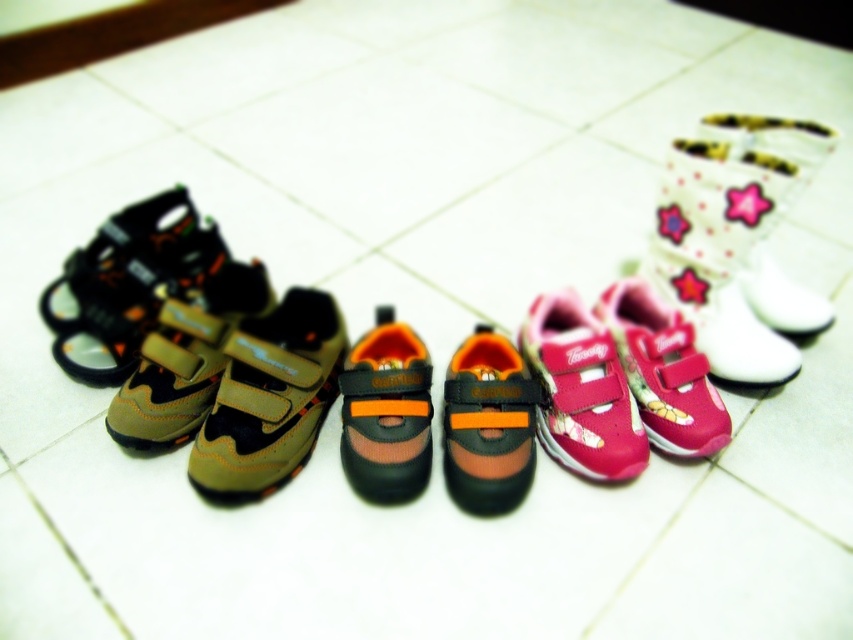
Question: Based on their relative distances, which object is farther from the pink velcro shoe at center?

Choices:
 (A) matte brown fabric shoe at left
 (B) pink velcro shoes at center
 (C) orange fabric shoe at center

Answer: (A)

Question: Observing the image, what is the correct spatial positioning of matte brown fabric shoe at left in reference to pink velcro shoes at center?

Choices:
 (A) left
 (B) right

Answer: (A)

Question: Considering the real-world distances, which object is farthest from the brown suede sandal at left?

Choices:
 (A) orange mesh shoe at center
 (B) pink fabric shoe at upper right

Answer: (B)

Question: Which point is closer to the camera taking this photo?

Choices:
 (A) (262, 381)
 (B) (190, 321)
 (C) (415, 435)
 (D) (451, 419)

Answer: (C)

Question: Does matte khaki shoe at center appear under orange mesh shoe at center?

Choices:
 (A) no
 (B) yes

Answer: (B)

Question: Is brown suede sandal at left wider than orange fabric shoe at center?

Choices:
 (A) yes
 (B) no

Answer: (A)